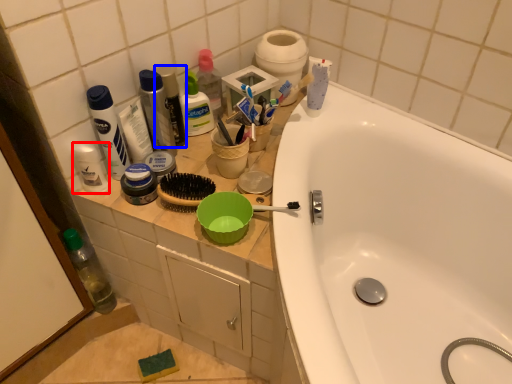
Question: Which object is closer to the camera taking this photo, toiletry (highlighted by a red box) or mouthwash (highlighted by a blue box)?

Choices:
 (A) toiletry
 (B) mouthwash

Answer: (A)